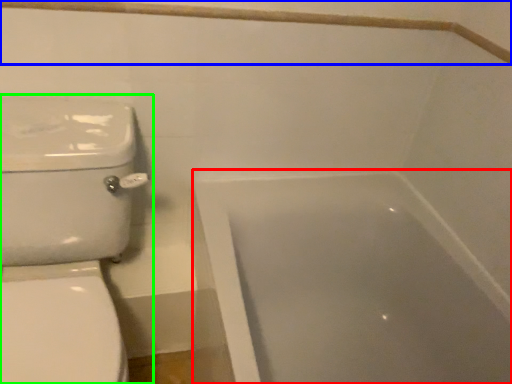
Question: Based on their relative distances, which object is nearer to bathtub (highlighted by a red box)? Choose from balustrade (highlighted by a blue box) and toilet (highlighted by a green box).

Choices:
 (A) balustrade
 (B) toilet

Answer: (B)